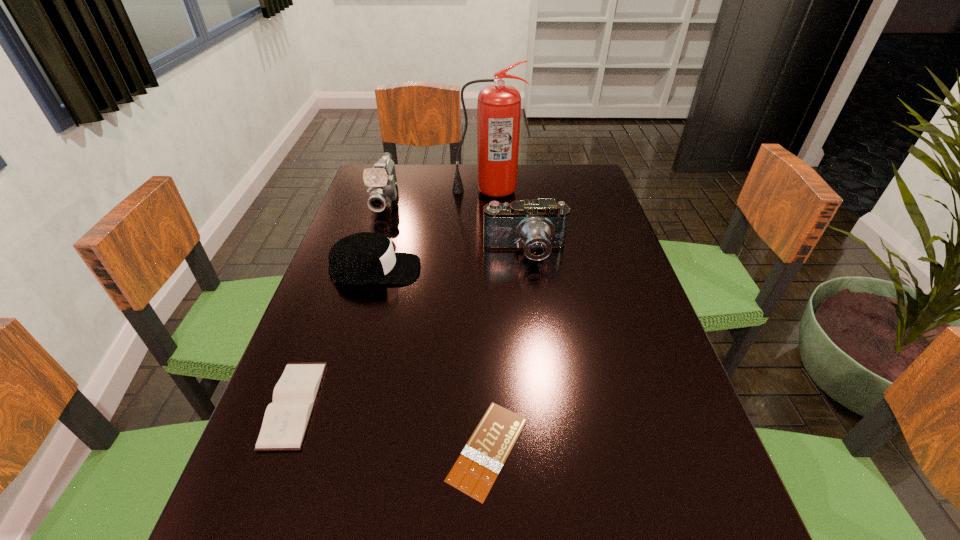
Locate an element on the screen. The image size is (960, 540). free space at the left edge of the desktop is located at coordinates (330, 353).

Locate an element on the screen. This screenshot has width=960, height=540. vacant space at the right edge of the desktop is located at coordinates (617, 254).

Image resolution: width=960 pixels, height=540 pixels. Identify the location of free space at the far right corner of the desktop. (601, 201).

Locate an element on the screen. The image size is (960, 540). vacant region between the shortest object and the left camcorder is located at coordinates (437, 323).

Where is `vacant area that lies between the second shortest object and the cap`? vacant area that lies between the second shortest object and the cap is located at coordinates (335, 337).

The width and height of the screenshot is (960, 540). Find the location of `free spot between the left camcorder and the right camcorder`. free spot between the left camcorder and the right camcorder is located at coordinates (455, 225).

You are a GUI agent. You are given a task and a screenshot of the screen. Output one action in this format:
    pyautogui.click(x=<x>, y=<y>)
    Task: Click on the empty location between the shortest object and the fourth tallest object
    The image size is (960, 540).
    Given the screenshot: What is the action you would take?
    pyautogui.click(x=432, y=360)

Locate an element on the screen. This screenshot has width=960, height=540. vacant area between the farther camcorder and the second shortest object is located at coordinates pos(340,301).

Locate an element on the screen. This screenshot has height=540, width=960. free area in between the nearer camcorder and the third shortest object is located at coordinates (450, 261).

You are a GUI agent. You are given a task and a screenshot of the screen. Output one action in this format:
    pyautogui.click(x=<x>, y=<y>)
    Task: Click on the unoccupied position between the nearer camcorder and the fifth tallest object
    The image size is (960, 540).
    Given the screenshot: What is the action you would take?
    pyautogui.click(x=410, y=329)